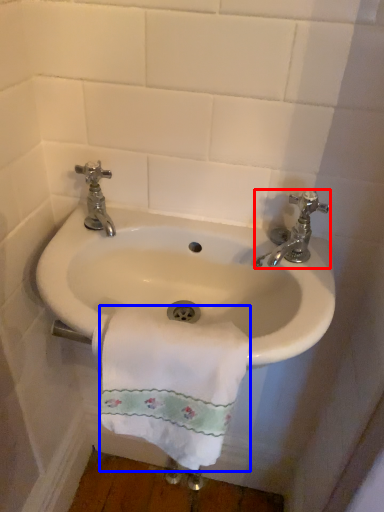
Question: Which object appears farthest to the camera in this image, tap (highlighted by a red box) or towel/napkin (highlighted by a blue box)?

Choices:
 (A) tap
 (B) towel/napkin

Answer: (A)